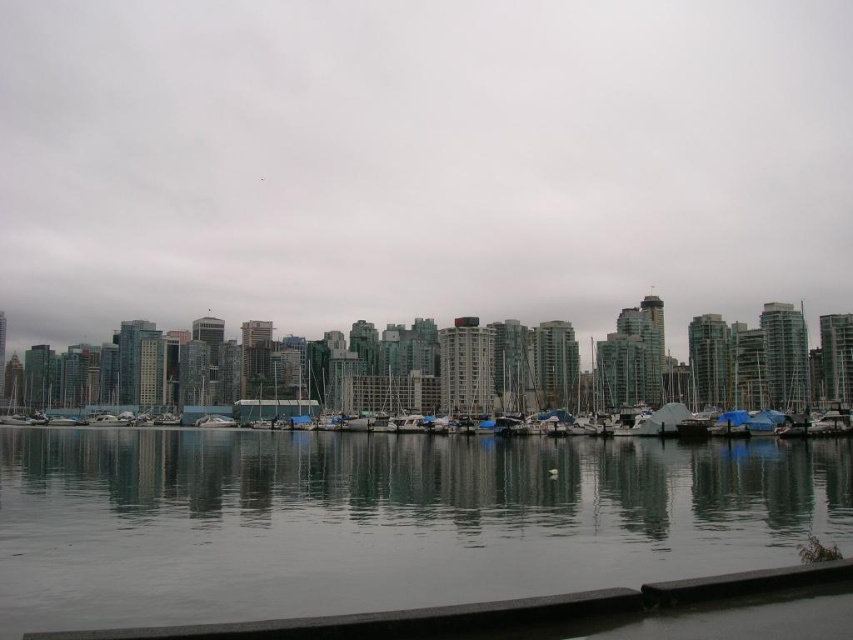
Question: Which of these objects is positioned closest to the smooth gray water at center?

Choices:
 (A) transparent glass skyscrapers at center
 (B) white glossy boat at center

Answer: (B)

Question: Based on their relative distances, which object is farther from the transparent glass skyscrapers at center?

Choices:
 (A) smooth gray water at center
 (B) white glossy boat at center

Answer: (B)

Question: Can you confirm if transparent glass skyscrapers at center is smaller than smooth gray water at center?

Choices:
 (A) yes
 (B) no

Answer: (B)

Question: Is transparent glass skyscrapers at center above white glossy boat at center?

Choices:
 (A) no
 (B) yes

Answer: (B)

Question: Which of these objects is positioned farthest from the smooth gray water at center?

Choices:
 (A) white glossy boat at center
 (B) transparent glass skyscrapers at center

Answer: (B)

Question: Is smooth gray water at center wider than white glossy boat at center?

Choices:
 (A) no
 (B) yes

Answer: (B)